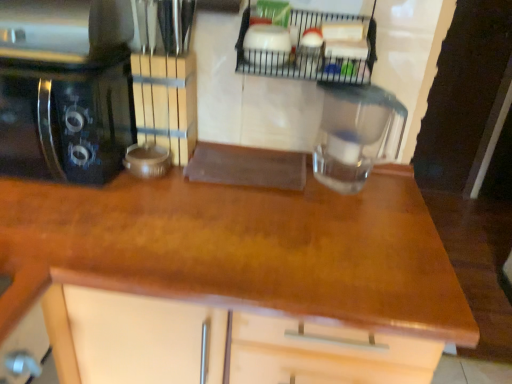
Locate an element on the screen. This screenshot has height=384, width=512. free location in front of black glossy coffee maker at left is located at coordinates (50, 230).